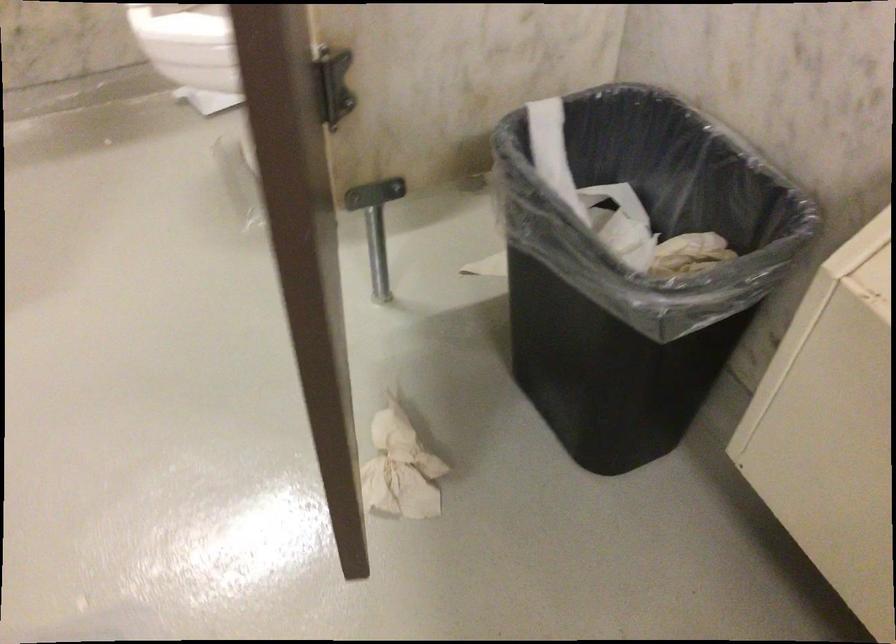
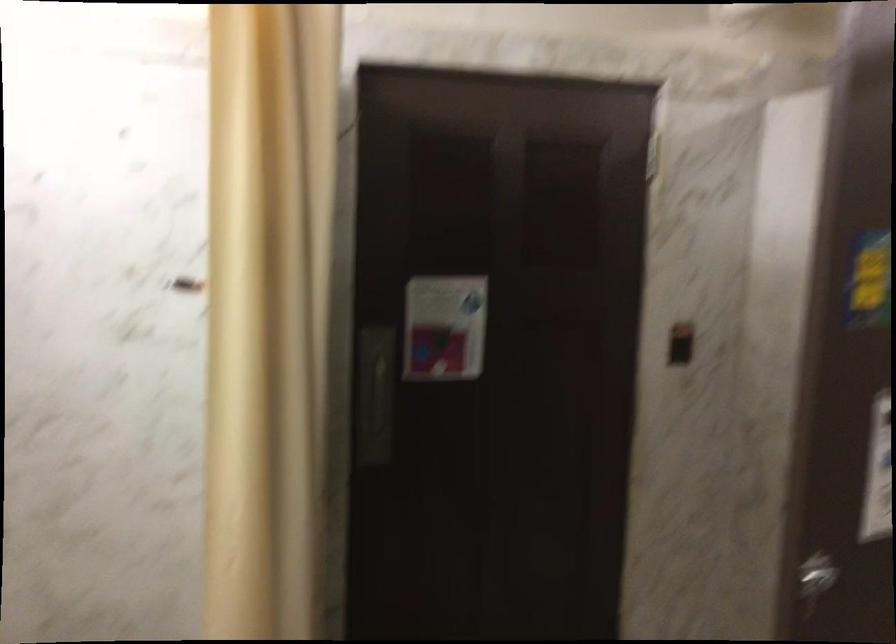
Question: The camera is either moving clockwise (left) or counter-clockwise (right) around the object. The first image is from the beginning of the video and the second image is from the end. Is the camera moving left or right when shooting the video?

Choices:
 (A) Left
 (B) Right

Answer: (B)